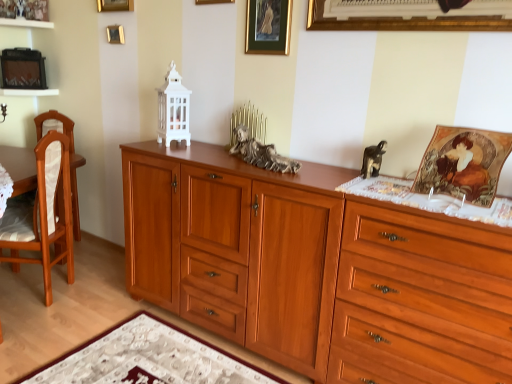
Image resolution: width=512 pixels, height=384 pixels. Identify the location of black glossy monkey at upper right, the first animal when ordered from right to left. (373, 159).

This screenshot has width=512, height=384. What do you see at coordinates (115, 5) in the screenshot?
I see `gold metallic picture frame at upper center, the 2th picture frame when ordered from left to right` at bounding box center [115, 5].

What do you see at coordinates (316, 270) in the screenshot? I see `wooden cabinet at center` at bounding box center [316, 270].

Consider the image. What is the approximate width of gold metallic picture frame at upper center, the third picture frame from the back?

The width of gold metallic picture frame at upper center, the third picture frame from the back, is 1.08 inches.

The height and width of the screenshot is (384, 512). Find the location of `black glossy monkey at upper right, the first animal when ordered from right to left`. black glossy monkey at upper right, the first animal when ordered from right to left is located at coordinates (373, 159).

Is gold metallic picture frame at upper center, the second picture frame from the top, facing towards wooden cabinet at center?

No.

Can you confirm if gold metallic picture frame at upper center, the third picture frame in the front-to-back sequence, is taller than wooden cabinet at center?

Incorrect, the height of gold metallic picture frame at upper center, the third picture frame in the front-to-back sequence, is not larger of that of wooden cabinet at center.

Is gold metallic picture frame at upper center, which is the fourth picture frame from bottom to top, inside or outside of wooden cabinet at center?

gold metallic picture frame at upper center, which is the fourth picture frame from bottom to top, is not enclosed by wooden cabinet at center.

Where is `mat beneath the light brown wood chair at left (from a real-world perspective)`? The width and height of the screenshot is (512, 384). mat beneath the light brown wood chair at left (from a real-world perspective) is located at coordinates (148, 359).

What's the angular difference between light brown wood chair at left and white textured mat at lower center's facing directions?

light brown wood chair at left and white textured mat at lower center are facing 61.8 degrees away from each other.

Is light brown wood chair at left far away from white textured mat at lower center?

No, light brown wood chair at left is not far away from white textured mat at lower center.

Does light brown wood chair at left have a greater height compared to white textured mat at lower center?

Correct, light brown wood chair at left is much taller as white textured mat at lower center.

Choose the correct answer: Is gold metallic picture frame at upper left, which is the 5th picture frame from right to left, inside gold metallic picture frame at upper center, the third picture frame from the back, or outside it?

gold metallic picture frame at upper left, which is the 5th picture frame from right to left, is located beyond the bounds of gold metallic picture frame at upper center, the third picture frame from the back.

From the image's perspective, which is above, gold metallic picture frame at upper left, the 1th picture frame viewed from the back, or gold metallic picture frame at upper center, which is the fourth picture frame from bottom to top?

gold metallic picture frame at upper center, which is the fourth picture frame from bottom to top, is shown above in the image.

Is gold metallic picture frame at upper left, which is the 5th picture frame in front-to-back order, not close to gold metallic picture frame at upper center, the second picture frame from the top?

They are positioned close to each other.

Are white textured mat at lower center and gold-framed picture at upper center, placed as the fourth picture frame when sorted from back to front, located far from each other?

Yes, white textured mat at lower center and gold-framed picture at upper center, placed as the fourth picture frame when sorted from back to front, are located far from each other.

From a real-world perspective, is white textured mat at lower center over gold-framed picture at upper center, which is the 4th picture frame from left to right?

No, from a real-world perspective, white textured mat at lower center is not above gold-framed picture at upper center, which is the 4th picture frame from left to right.

In the scene shown: Which is behind, white textured mat at lower center or gold-framed picture at upper center, which is the 4th picture frame from left to right?

gold-framed picture at upper center, which is the 4th picture frame from left to right, is further from the camera.

This screenshot has width=512, height=384. Find the location of `the 2nd picture frame behind the white textured mat at lower center, starting your count from the anchor`. the 2nd picture frame behind the white textured mat at lower center, starting your count from the anchor is located at coordinates (268, 27).

Does black glossy monkey at upper right, which ranks as the 2th animal in left-to-right order, have a greater height compared to gold metallic picture frame at upper center, the third picture frame from the back?

No, black glossy monkey at upper right, which ranks as the 2th animal in left-to-right order, is not taller than gold metallic picture frame at upper center, the third picture frame from the back.

Where is `animal that is the 2nd one when counting forward from the gold metallic picture frame at upper center, acting as the third picture frame starting from the left`? The width and height of the screenshot is (512, 384). animal that is the 2nd one when counting forward from the gold metallic picture frame at upper center, acting as the third picture frame starting from the left is located at coordinates (373, 159).

Is black glossy monkey at upper right, which ranks as the 2th animal in left-to-right order, situated inside gold metallic picture frame at upper center, the second picture frame from the top, or outside?

black glossy monkey at upper right, which ranks as the 2th animal in left-to-right order, exists outside the volume of gold metallic picture frame at upper center, the second picture frame from the top.

Between gold metallic picture frame at upper center, the 2th picture frame when ordered from left to right, and wooden cabinet at center, which one appears on the right side from the viewer's perspective?

wooden cabinet at center is more to the right.

Which of these two, gold metallic picture frame at upper center, which is the first picture frame from top to bottom, or wooden cabinet at center, is smaller?

Smaller between the two is gold metallic picture frame at upper center, which is the first picture frame from top to bottom.

From the picture: Is gold metallic picture frame at upper center, which is the first picture frame from top to bottom, oriented towards wooden cabinet at center?

No.

How different are the orientations of gold metallic picture frame at upper center, which is the first picture frame from top to bottom, and wooden cabinet at center in degrees?

Answer: 0.22 degrees.

Consider the image. Who is taller, light brown wood chair at left or bronze statue at center, the second animal in the right-to-left sequence?

light brown wood chair at left.

Considering the relative sizes of light brown wood chair at left and bronze statue at center, the second animal in the right-to-left sequence, in the image provided, is light brown wood chair at left thinner than bronze statue at center, the second animal in the right-to-left sequence,?

Incorrect, the width of light brown wood chair at left is not less than that of bronze statue at center, the second animal in the right-to-left sequence.

Consider the image. Is light brown wood chair at left touching bronze statue at center, the second animal in the right-to-left sequence?

No, light brown wood chair at left is not touching bronze statue at center, the second animal in the right-to-left sequence.

Identify the location of cabinetry that appears below the gold metallic picture frame at upper center, acting as the third picture frame starting from the left (from a real-world perspective). (316, 270).

You are a GUI agent. You are given a task and a screenshot of the screen. Output one action in this format:
    pyautogui.click(x=<x>, y=<y>)
    Task: Click on the mat below the light brown wood chair at left (from the image's perspective)
    This screenshot has width=512, height=384.
    Given the screenshot: What is the action you would take?
    pyautogui.click(x=148, y=359)

Which object lies further to the anchor point gold metallic picture frame at upper left, which is the 5th picture frame from right to left, gold-framed picture at upper center, which is the 4th picture frame from left to right, or shiny brown chest of drawers at right?

shiny brown chest of drawers at right.

When comparing their distances from black glossy monkey at upper right, which ranks as the 2th animal in left-to-right order, does gold-framed picture at upper center, arranged as the second picture frame when viewed from the front, or white textured mat at lower center seem further?

white textured mat at lower center lies further to black glossy monkey at upper right, which ranks as the 2th animal in left-to-right order, than the other object.

Estimate the real-world distances between objects in this image. Which object is further from white textured mat at lower center, light brown wood chair at left or gold-framed picture at upper center, positioned as the second picture frame in right-to-left order?

gold-framed picture at upper center, positioned as the second picture frame in right-to-left order, lies further to white textured mat at lower center than the other object.

From the image, which object appears to be nearer to gold metallic picture frame at upper center, which is the fourth picture frame from bottom to top, gold metallic picture frame at upper left, placed as the 1th picture frame when sorted from left to right, or light brown wood chair at left?

gold metallic picture frame at upper left, placed as the 1th picture frame when sorted from left to right.

Looking at the image, which one is located further to matte gold picture frame at upper right, marked as the 5th picture frame in a back-to-front arrangement, bronze statue at center, which is the first animal in left-to-right order, or light brown wood chair at left?

Among the two, light brown wood chair at left is located further to matte gold picture frame at upper right, marked as the 5th picture frame in a back-to-front arrangement.

Based on their spatial positions, is wooden cabinet at center or light brown wood chair at left further from matte gold picture frame at upper right, the first picture frame positioned from the front?

The object further to matte gold picture frame at upper right, the first picture frame positioned from the front, is light brown wood chair at left.

Considering their positions, is gold metallic picture frame at upper center, acting as the third picture frame starting from the left, positioned closer to black glossy monkey at upper right, the first animal when ordered from right to left, than gold-framed picture at upper center, which is the 4th picture frame from left to right?

Based on the image, gold-framed picture at upper center, which is the 4th picture frame from left to right, appears to be nearer to black glossy monkey at upper right, the first animal when ordered from right to left.

From the image, which object appears to be nearer to bronze statue at center, which is the first animal in left-to-right order, gold metallic picture frame at upper center, placed as the fifth picture frame when sorted from bottom to top, or gold-framed picture at upper center, arranged as the second picture frame when viewed from the front?

gold-framed picture at upper center, arranged as the second picture frame when viewed from the front, is closer to bronze statue at center, which is the first animal in left-to-right order.

The width and height of the screenshot is (512, 384). In order to click on animal between gold metallic picture frame at upper center, which ranks as the 4th picture frame in front-to-back order, and black glossy monkey at upper right, the first animal when ordered from right to left in this screenshot , I will do `click(261, 153)`.

You are a GUI agent. You are given a task and a screenshot of the screen. Output one action in this format:
    pyautogui.click(x=<x>, y=<y>)
    Task: Click on the cabinetry between gold metallic picture frame at upper left, placed as the third picture frame when sorted from top to bottom, and white textured mat at lower center vertically
    
    Given the screenshot: What is the action you would take?
    pyautogui.click(x=316, y=270)

Find the location of `cabinetry between light brown wood chair at left and shiny brown chest of drawers at right from left to right`. cabinetry between light brown wood chair at left and shiny brown chest of drawers at right from left to right is located at coordinates (316, 270).

Identify the location of animal between gold metallic picture frame at upper center, which is the fourth picture frame from bottom to top, and black glossy monkey at upper right, the first animal when ordered from right to left, vertically. (261, 153).